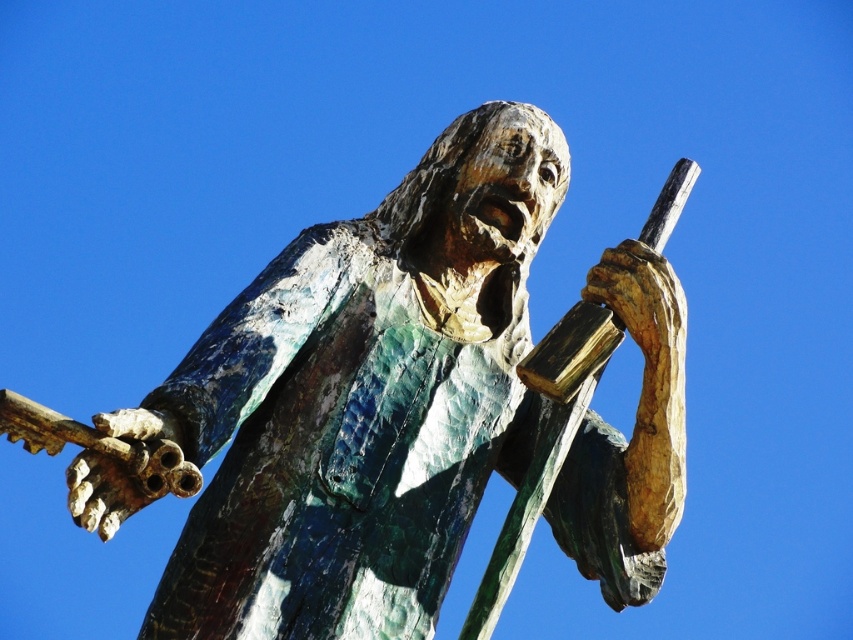
Question: Observing the image, what is the correct spatial positioning of green patina statue at center in reference to bronze textured hand at upper right?

Choices:
 (A) below
 (B) above

Answer: (A)

Question: Among these points, which one is nearest to the camera?

Choices:
 (A) (654, 412)
 (B) (375, 477)

Answer: (B)

Question: Is green patina statue at center closer to the viewer compared to bronze textured hand at upper right?

Choices:
 (A) yes
 (B) no

Answer: (A)

Question: Does green patina statue at center appear under bronze textured hand at upper right?

Choices:
 (A) yes
 (B) no

Answer: (A)